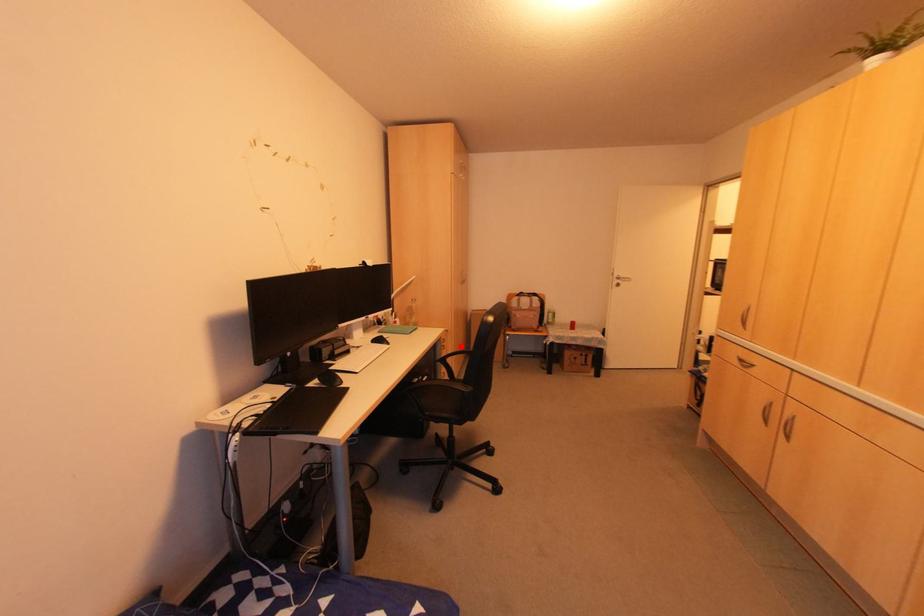
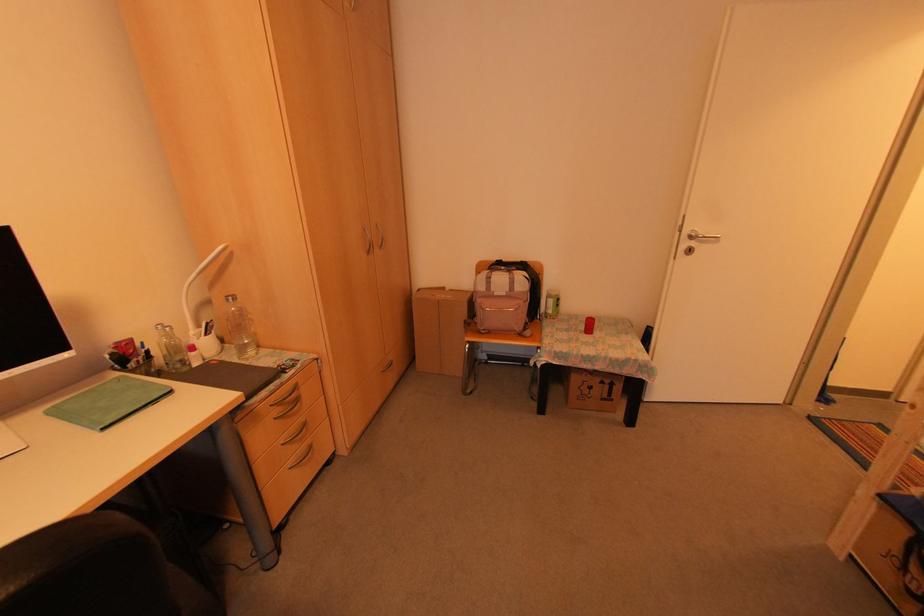
Question: I am providing you with two images of the same scene from different viewpoints. Image1 has a red point marked. In image2, the corresponding 3D location appears at what relative position? Reply with the corresponding letter.

Choices:
 (A) Closer
 (B) Farther

Answer: (A)